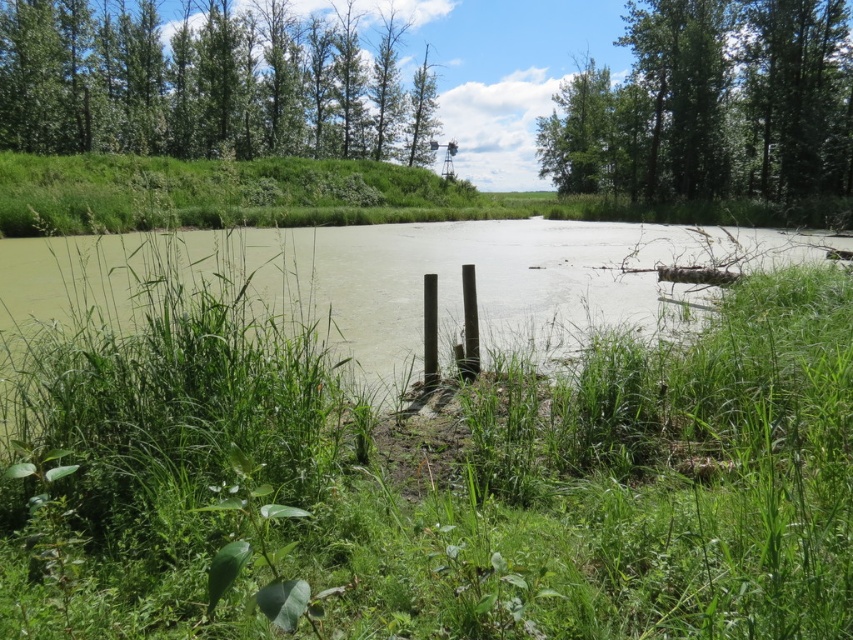
Question: Is green grass at center bigger than green leafy trees at upper center?

Choices:
 (A) yes
 (B) no

Answer: (B)

Question: Which object appears farthest from the camera in this image?

Choices:
 (A) green grass at center
 (B) green leafy trees at upper center
 (C) green leafy tree at upper right

Answer: (C)

Question: Based on their relative distances, which object is farther from the green leafy trees at upper center?

Choices:
 (A) green grass at center
 (B) green leafy tree at upper right

Answer: (A)

Question: Is green grass at center wider than green leafy tree at upper right?

Choices:
 (A) yes
 (B) no

Answer: (A)

Question: Can you confirm if green grass at center is thinner than green leafy tree at upper right?

Choices:
 (A) yes
 (B) no

Answer: (B)

Question: Which object appears farthest from the camera in this image?

Choices:
 (A) green leafy tree at upper right
 (B) green leafy trees at upper center
 (C) green grass at center

Answer: (A)